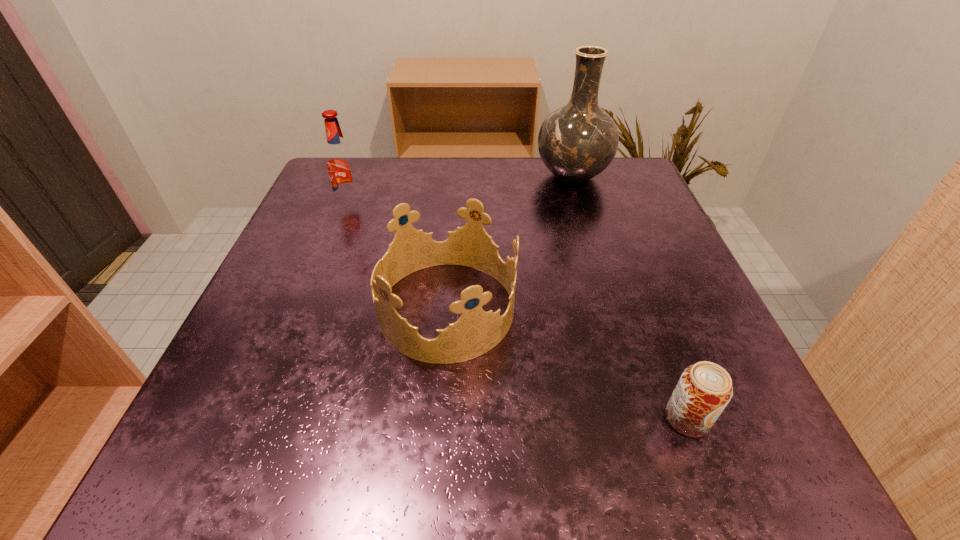
This screenshot has width=960, height=540. Find the location of `blank region between the shortest object and the third tallest object`. blank region between the shortest object and the third tallest object is located at coordinates (566, 363).

Locate an element on the screen. The height and width of the screenshot is (540, 960). free space between the third nearest object and the shortest object is located at coordinates (518, 312).

You are a GUI agent. You are given a task and a screenshot of the screen. Output one action in this format:
    pyautogui.click(x=<x>, y=<y>)
    Task: Click on the object that is the second closest one to the nearest object
    The image size is (960, 540).
    Given the screenshot: What is the action you would take?
    pyautogui.click(x=578, y=141)

Identify which object is the closest to the tallest object. Please provide its 2D coordinates. Your answer should be formatted as a tuple, i.e. [(x, y)], where the tuple contains the x and y coordinates of a point satisfying the conditions above.

[(476, 332)]

Where is `vacant point that satisfies the following two spatial constraints: 1. on the back side of the leftmost object; 2. on the left side of the farthest object`? vacant point that satisfies the following two spatial constraints: 1. on the back side of the leftmost object; 2. on the left side of the farthest object is located at coordinates (362, 176).

Where is `vacant space that satisfies the following two spatial constraints: 1. on the back side of the tallest object; 2. on the right side of the root beer`? vacant space that satisfies the following two spatial constraints: 1. on the back side of the tallest object; 2. on the right side of the root beer is located at coordinates (362, 176).

In order to click on free space that satisfies the following two spatial constraints: 1. on the front-facing side of the tiara; 2. on the left side of the beer can in this screenshot , I will do `click(436, 418)`.

Find the location of `vacant space that satisfies the following two spatial constraints: 1. on the back side of the vase; 2. on the right side of the leftmost object`. vacant space that satisfies the following two spatial constraints: 1. on the back side of the vase; 2. on the right side of the leftmost object is located at coordinates (362, 176).

Locate an element on the screen. Image resolution: width=960 pixels, height=540 pixels. blank area in the image that satisfies the following two spatial constraints: 1. on the front side of the farthest object; 2. on the front-facing side of the second object from left to right is located at coordinates (612, 309).